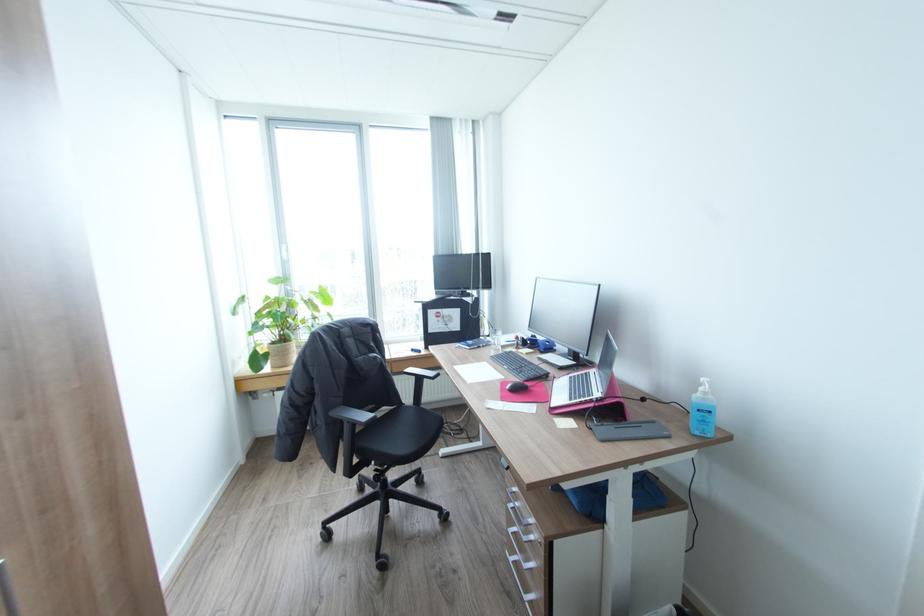
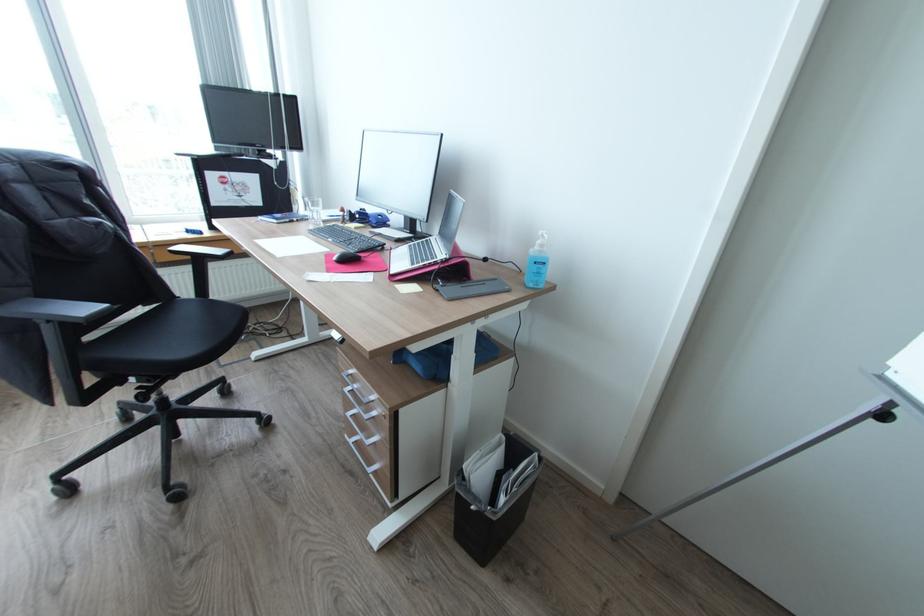
Where in the second image is the point corresponding to [354,422] from the first image?

(55, 321)